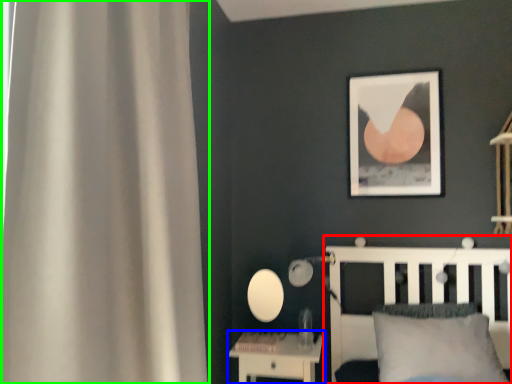
Question: Estimate the real-world distances between objects in this image. Which object is farther from bed (highlighted by a red box), nightstand (highlighted by a blue box) or curtain (highlighted by a green box)?

Choices:
 (A) nightstand
 (B) curtain

Answer: (B)